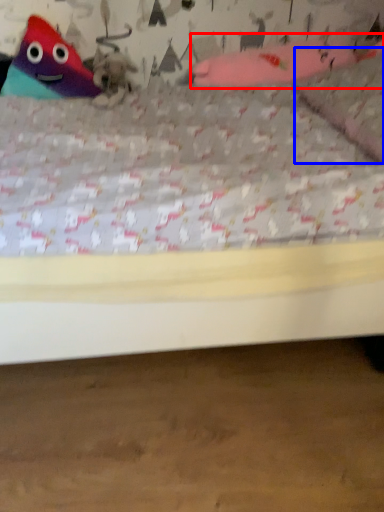
Question: Which object appears closest to the camera in this image, toy (highlighted by a red box) or pillow (highlighted by a blue box)?

Choices:
 (A) toy
 (B) pillow

Answer: (B)